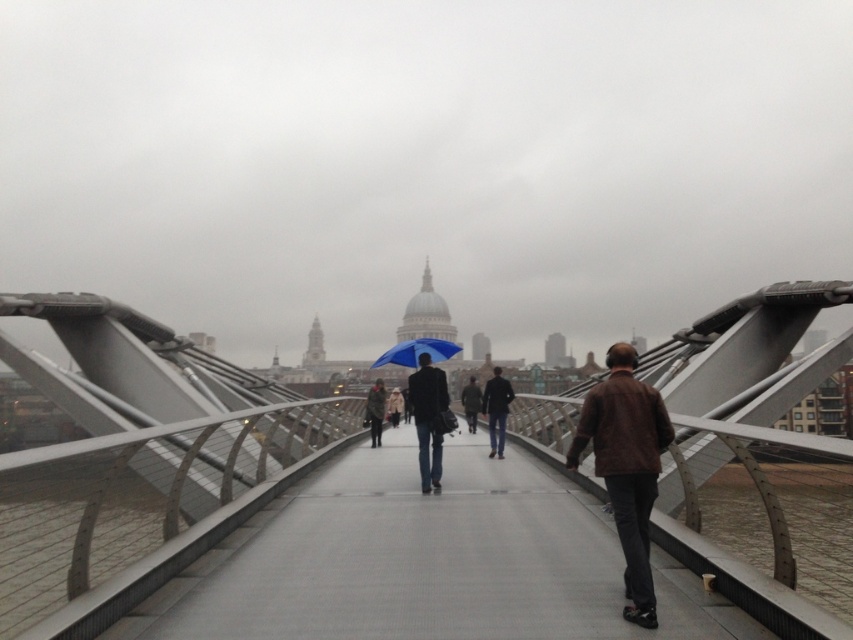
Question: Which object is farther from the camera taking this photo?

Choices:
 (A) metallic gray suspension bridge at center
 (B) blue fabric umbrella at center

Answer: (B)

Question: Does dark blue jacket at center appear on the right side of light brown leather jacket at center?

Choices:
 (A) yes
 (B) no

Answer: (A)

Question: Which point is farther to the camera?

Choices:
 (A) dark gray fabric coat at center
 (B) blue fabric umbrella at center
 (C) light brown leather jacket at center
 (D) matte blue umbrella at center

Answer: (C)

Question: Does dark gray fabric coat at center appear on the left side of light brown leather jacket at center?

Choices:
 (A) yes
 (B) no

Answer: (A)

Question: Can you confirm if dark brown leather jacket at center is bigger than light brown leather jacket at center?

Choices:
 (A) no
 (B) yes

Answer: (B)

Question: Estimate the real-world distances between objects in this image. Which object is farther from the metallic gray suspension bridge at center?

Choices:
 (A) dark blue jacket at center
 (B) matte blue umbrella at center

Answer: (A)